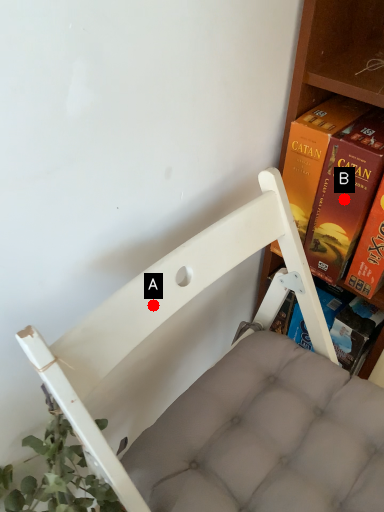
Question: Two points are circled on the image, labeled by A and B beside each circle. Which point is closer to the camera?

Choices:
 (A) A is closer
 (B) B is closer

Answer: (A)